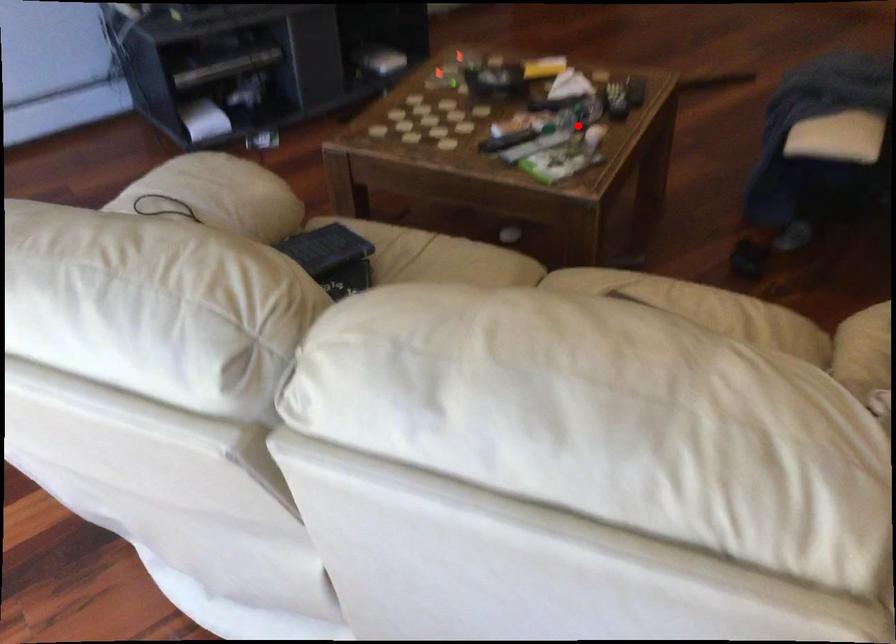
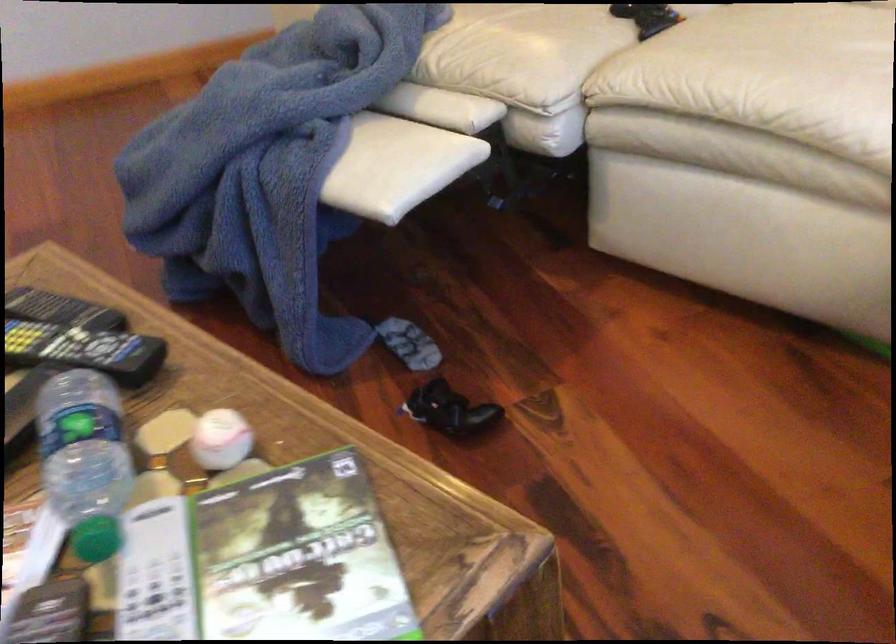
Question: I am providing you with two images of the same scene from different viewpoints. Given a red point in image1, look at the same physical point in image2. Is it:

Choices:
 (A) Closer to the viewpoint
 (B) Farther from the viewpoint

Answer: (A)